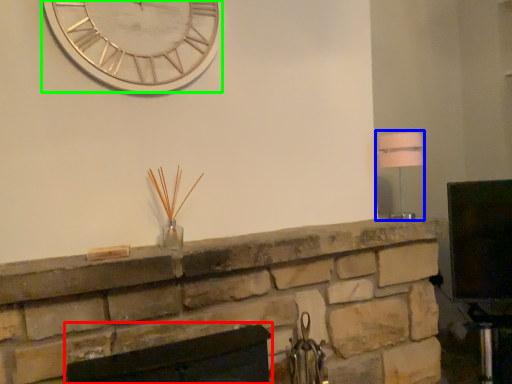
Question: Considering the real-world distances, which object is farthest from fireplace (highlighted by a red box)? lamp (highlighted by a blue box) or wall clock (highlighted by a green box)?

Choices:
 (A) lamp
 (B) wall clock

Answer: (A)